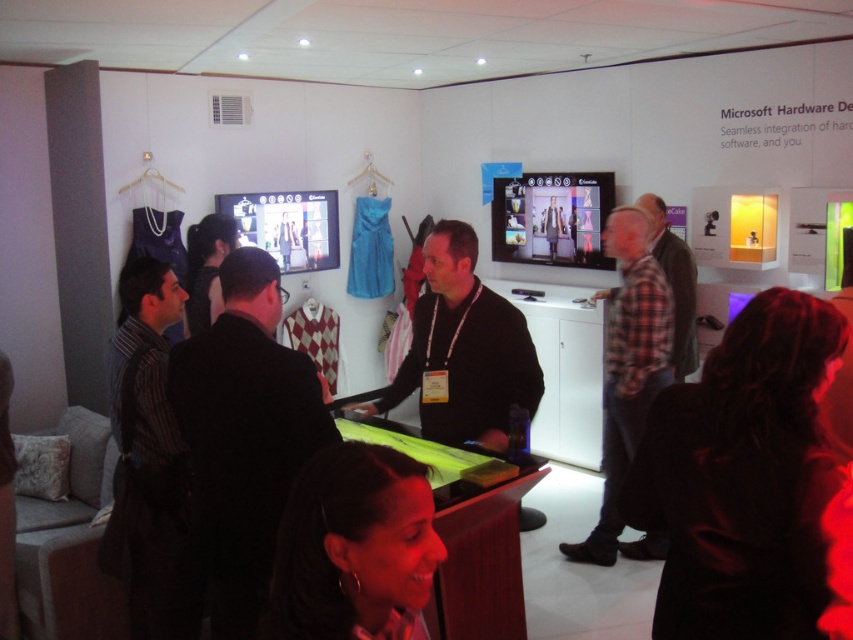
Consider the image. You are attending a Microsoft Hardware event and notice two pieces of clothing at the center of the table. Which one is positioned lower between the black fabric jacket at center and the plaid fabric shirt at center?

The black fabric jacket at center is positioned lower than the plaid fabric shirt at center.